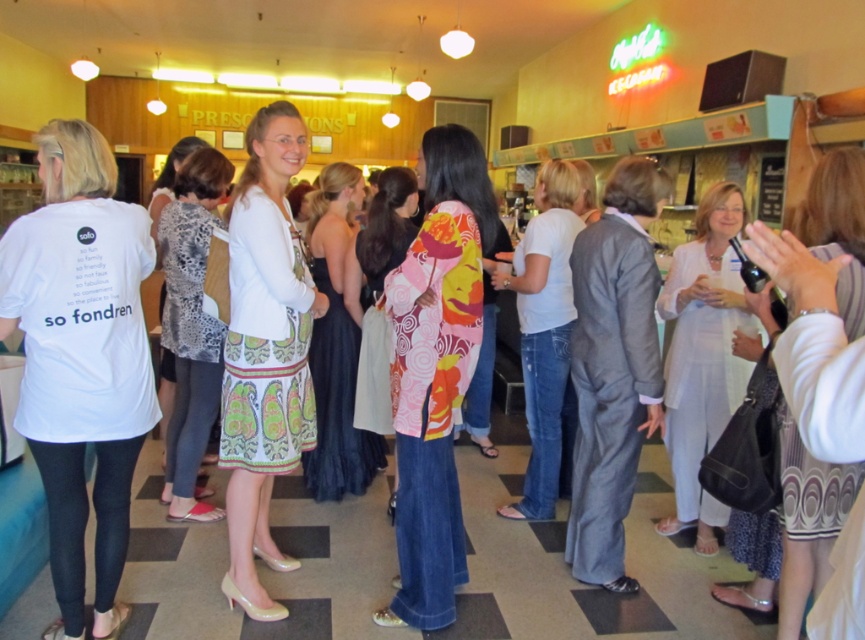
You are a photographer at the event and want to capture both the printed fabric dress at center and the black satin dress at center in a single photo. However, your camera can only focus on one subject at a time. Which dress should you focus on to ensure the other is still visible in the background?

You should focus on the printed fabric dress at center because it is in front of the black satin dress at center, so the latter will naturally appear in the background.